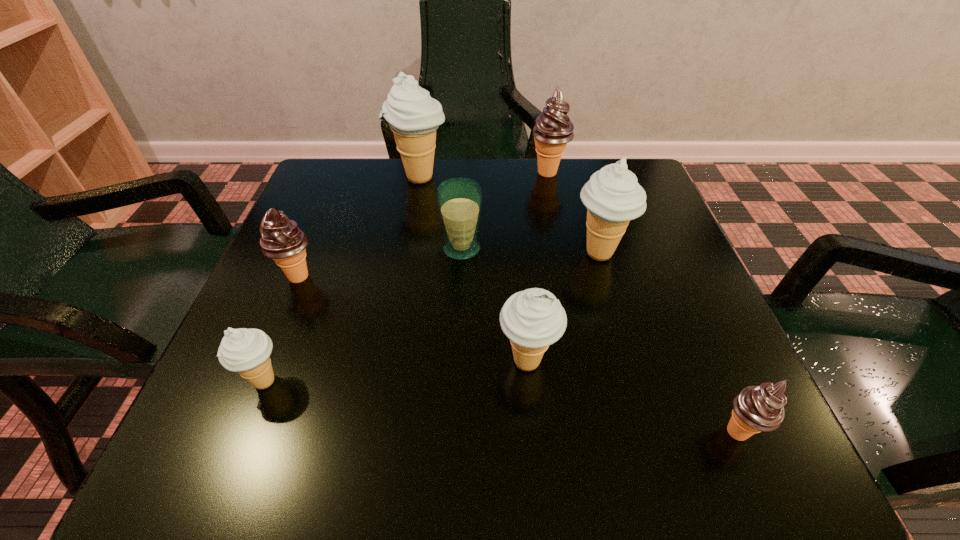
You are a GUI agent. You are given a task and a screenshot of the screen. Output one action in this format:
    pyautogui.click(x=<x>, y=<y>)
    Task: Click on the leftmost beige icecream
    Image resolution: width=960 pixels, height=540 pixels.
    Given the screenshot: What is the action you would take?
    pyautogui.click(x=246, y=351)

Where is `the nearest chocolate icecream`? Image resolution: width=960 pixels, height=540 pixels. the nearest chocolate icecream is located at coordinates (760, 408).

The width and height of the screenshot is (960, 540). In order to click on the nearest object in this screenshot , I will do `click(760, 408)`.

Locate an element on the screen. vacant point located on the right of the third icecream from left to right is located at coordinates (573, 178).

Find the location of `vacant area located 0.260m on the front of the farthest chocolate icecream`. vacant area located 0.260m on the front of the farthest chocolate icecream is located at coordinates (565, 255).

Locate an element on the screen. The width and height of the screenshot is (960, 540). vacant region located 0.280m on the back of the rightmost beige icecream is located at coordinates (574, 165).

The height and width of the screenshot is (540, 960). I want to click on vacant space located 0.280m on the back of the second farthest chocolate icecream, so click(336, 184).

You are a GUI agent. You are given a task and a screenshot of the screen. Output one action in this format:
    pyautogui.click(x=<x>, y=<y>)
    Task: Click on the vacant position located on the right of the third beige icecream from left to right
    This screenshot has height=540, width=960.
    Given the screenshot: What is the action you would take?
    pyautogui.click(x=719, y=362)

The height and width of the screenshot is (540, 960). I want to click on vacant space located 0.390m on the front of the blue glass, so click(452, 460).

At what (x,y) coordinates should I click in order to perform the action: click on free space located on the back of the smallest beige icecream. Please return your answer as a coordinate pair (x, y). This screenshot has width=960, height=540. Looking at the image, I should click on (313, 257).